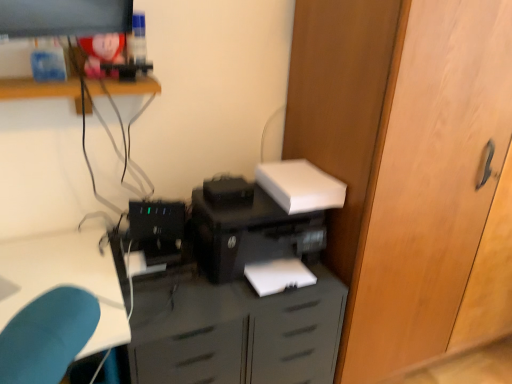
Question: From a real-world perspective, is matte black printer at lower center under wooden door at center-right?

Choices:
 (A) no
 (B) yes

Answer: (B)

Question: From the image's perspective, does matte black printer at lower center appear lower than wooden door at center-right?

Choices:
 (A) yes
 (B) no

Answer: (A)

Question: Can you confirm if matte black printer at lower center is thinner than wooden door at center-right?

Choices:
 (A) yes
 (B) no

Answer: (A)

Question: Would you say matte black printer at lower center is outside wooden door at center-right?

Choices:
 (A) yes
 (B) no

Answer: (A)

Question: From a real-world perspective, is matte black printer at lower center located higher than wooden door at center-right?

Choices:
 (A) no
 (B) yes

Answer: (A)

Question: Considering the positions of point (222, 374) and point (74, 74), is point (222, 374) closer or farther from the camera than point (74, 74)?

Choices:
 (A) farther
 (B) closer

Answer: (B)

Question: Would you say matte black printer at lower center is to the left or to the right of wooden shelf at upper left in the picture?

Choices:
 (A) left
 (B) right

Answer: (B)

Question: From a real-world perspective, is matte black printer at lower center positioned above or below wooden shelf at upper left?

Choices:
 (A) below
 (B) above

Answer: (A)

Question: Based on their sizes in the image, would you say matte black printer at lower center is bigger or smaller than wooden shelf at upper left?

Choices:
 (A) small
 (B) big

Answer: (B)

Question: Relative to matte black printer at lower center, is wooden shelf at upper left in front or behind?

Choices:
 (A) behind
 (B) front

Answer: (B)

Question: In the image, is wooden shelf at upper left on the left side or the right side of matte black printer at lower center?

Choices:
 (A) right
 (B) left

Answer: (B)

Question: From a real-world perspective, is wooden shelf at upper left positioned above or below matte black printer at lower center?

Choices:
 (A) below
 (B) above

Answer: (B)

Question: Considering the positions of wooden shelf at upper left and matte black printer at lower center in the image, is wooden shelf at upper left bigger or smaller than matte black printer at lower center?

Choices:
 (A) big
 (B) small

Answer: (B)

Question: Based on their sizes in the image, would you say black plastic printer at center is bigger or smaller than black plastic computer tower at center?

Choices:
 (A) small
 (B) big

Answer: (B)

Question: Is black plastic printer at center taller or shorter than black plastic computer tower at center?

Choices:
 (A) short
 (B) tall

Answer: (B)